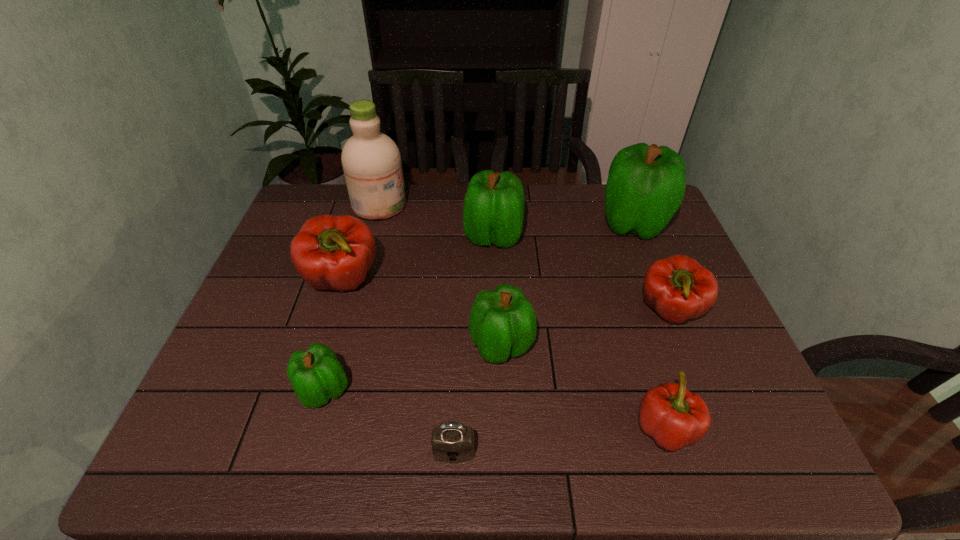
Identify the location of padlock that is positioned at the near edge. (452, 442).

Identify the location of object located in the left edge section of the desktop. This screenshot has width=960, height=540. (330, 252).

I want to click on object that is at the far right corner, so click(x=646, y=184).

The height and width of the screenshot is (540, 960). In the image, there is a desktop. In order to click on free space at the far edge in this screenshot , I will do `click(457, 183)`.

Identify the location of vacant space at the near edge of the desktop. The image size is (960, 540). (559, 454).

Where is `free space at the left edge`? The width and height of the screenshot is (960, 540). free space at the left edge is located at coordinates (280, 294).

Where is `blank space at the right edge of the desktop`? The height and width of the screenshot is (540, 960). blank space at the right edge of the desktop is located at coordinates (636, 265).

The image size is (960, 540). In the image, there is a desktop. What are the coordinates of `free space at the near left corner` in the screenshot? It's located at (244, 465).

You are a GUI agent. You are given a task and a screenshot of the screen. Output one action in this format:
    pyautogui.click(x=<x>, y=<y>)
    Task: Click on the free location at the near right corner of the desktop
    
    Given the screenshot: What is the action you would take?
    pyautogui.click(x=717, y=436)

Where is `free space between the padlock and the third biggest green bell pepper`? This screenshot has width=960, height=540. free space between the padlock and the third biggest green bell pepper is located at coordinates (478, 399).